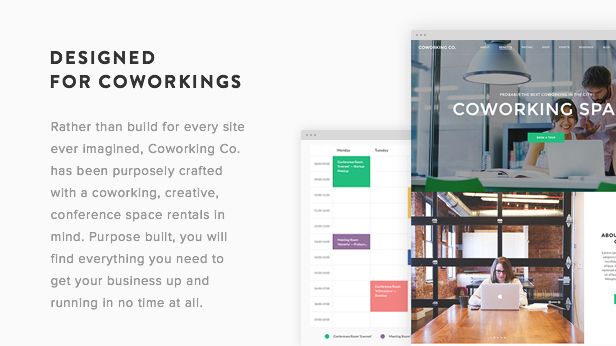
The image size is (616, 346). Identify the location of windows. (427, 249), (440, 249), (454, 249), (485, 249), (416, 115), (544, 64), (592, 56).